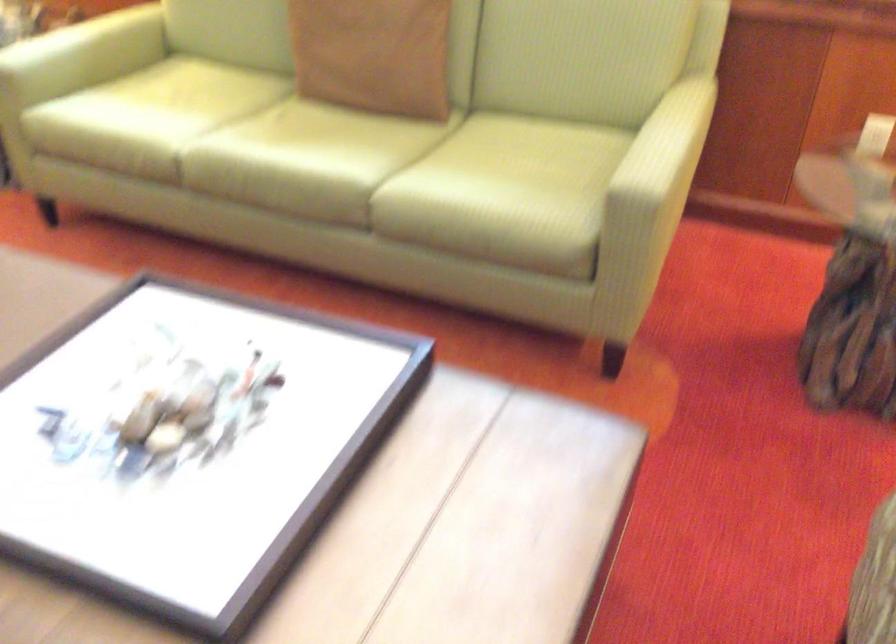
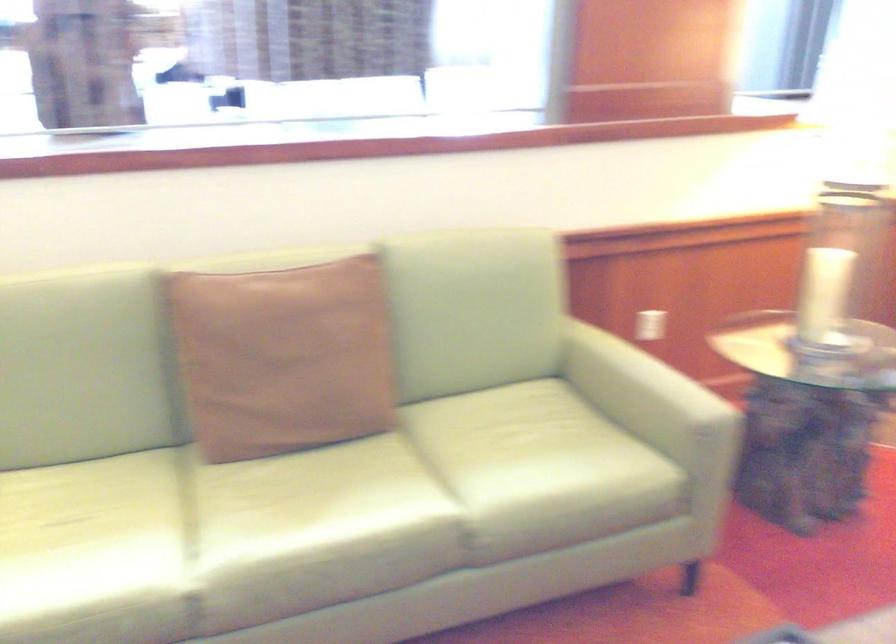
The point at [626,146] is marked in the first image. Where is the corresponding point in the second image?

(640, 386)